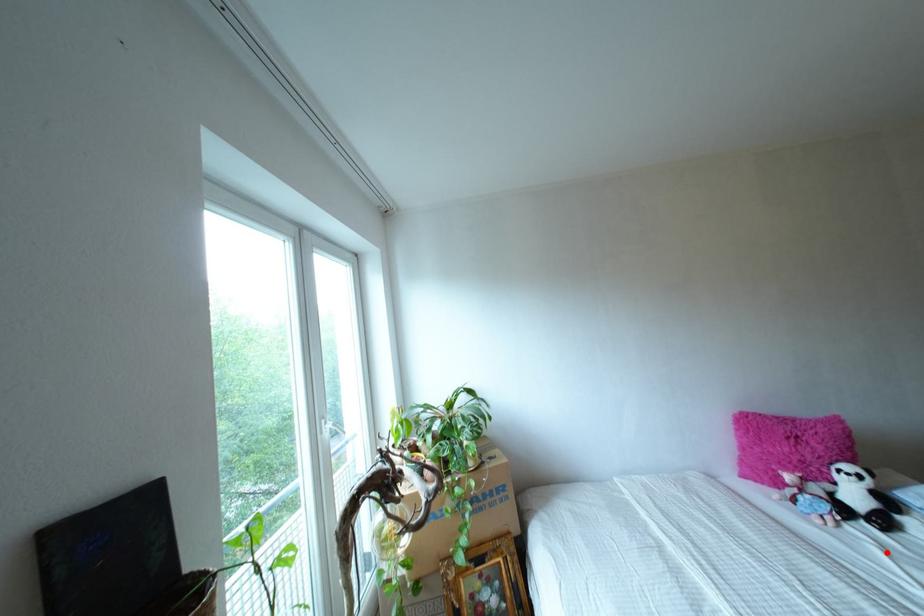
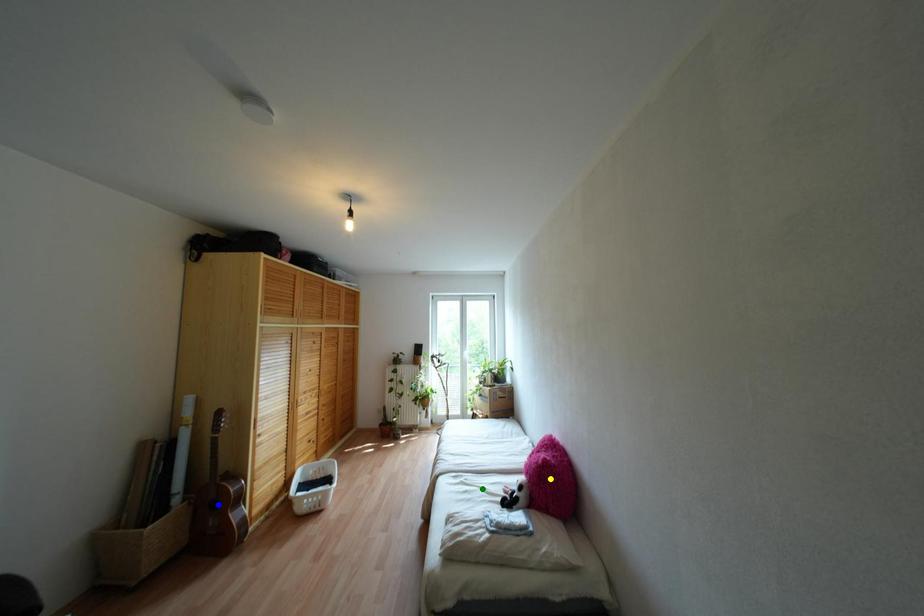
Question: I am providing you with two images of the same scene from different viewpoints. A red point is marked on the first image. You are given multiple points on the second image. Which point in image 2 is actually the same real-world point as the red point in image 1?

Choices:
 (A) blue point
 (B) green point
 (C) yellow point

Answer: (B)